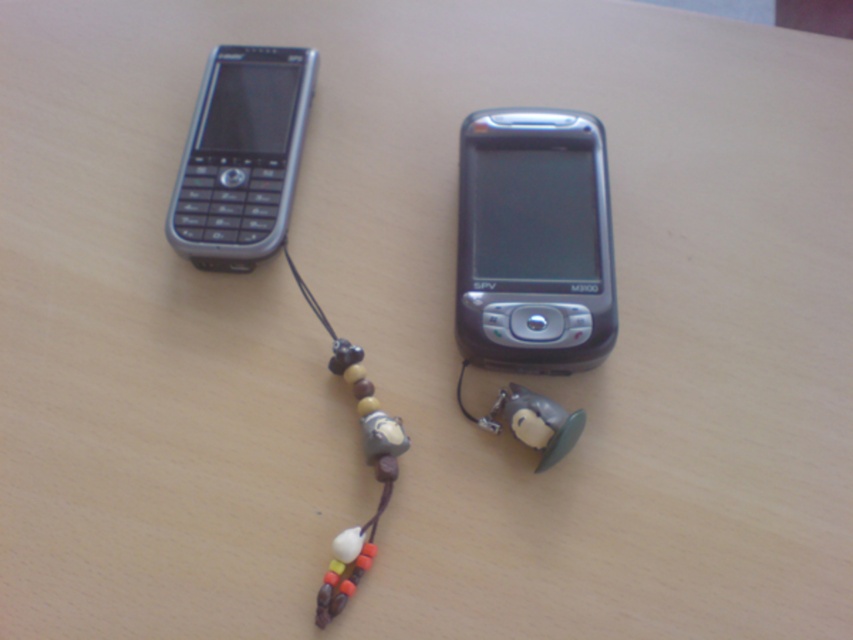
Question: Which of these objects is positioned farthest from the multicolored beaded string at center?

Choices:
 (A) slate gray plastic smartphone at center
 (B) silver metallic phone at upper left

Answer: (A)

Question: Is silver metallic phone at upper left to the left of multicolored beaded string at center from the viewer's perspective?

Choices:
 (A) no
 (B) yes

Answer: (B)

Question: Which is farther from the silver metallic phone at upper left?

Choices:
 (A) multicolored beaded string at center
 (B) slate gray plastic smartphone at center

Answer: (B)

Question: Can you confirm if slate gray plastic smartphone at center is positioned to the left of silver metallic phone at upper left?

Choices:
 (A) no
 (B) yes

Answer: (A)

Question: Can you confirm if silver metallic phone at upper left is positioned below multicolored beaded string at center?

Choices:
 (A) yes
 (B) no

Answer: (B)

Question: Among these objects, which one is farthest from the camera?

Choices:
 (A) slate gray plastic smartphone at center
 (B) multicolored beaded string at center
 (C) silver metallic phone at upper left

Answer: (C)